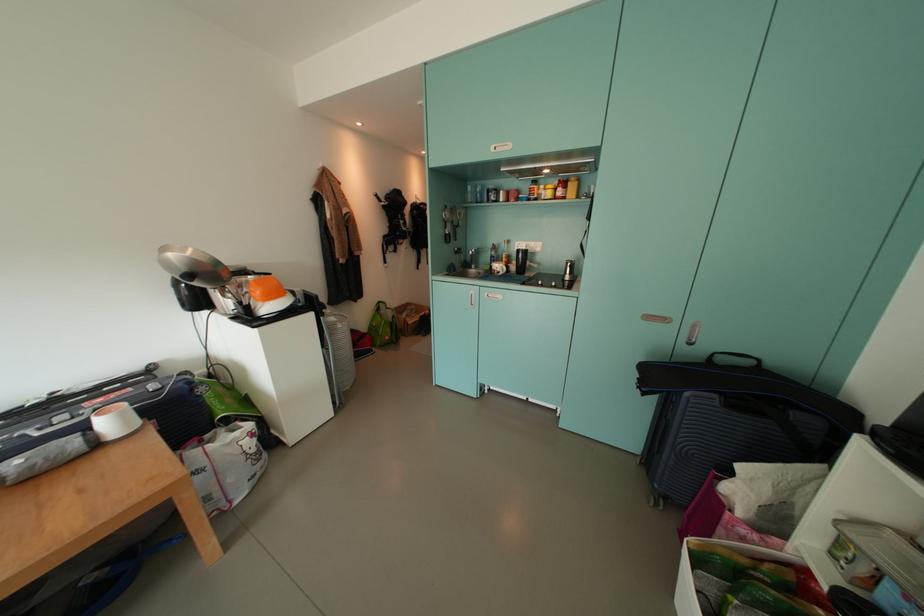
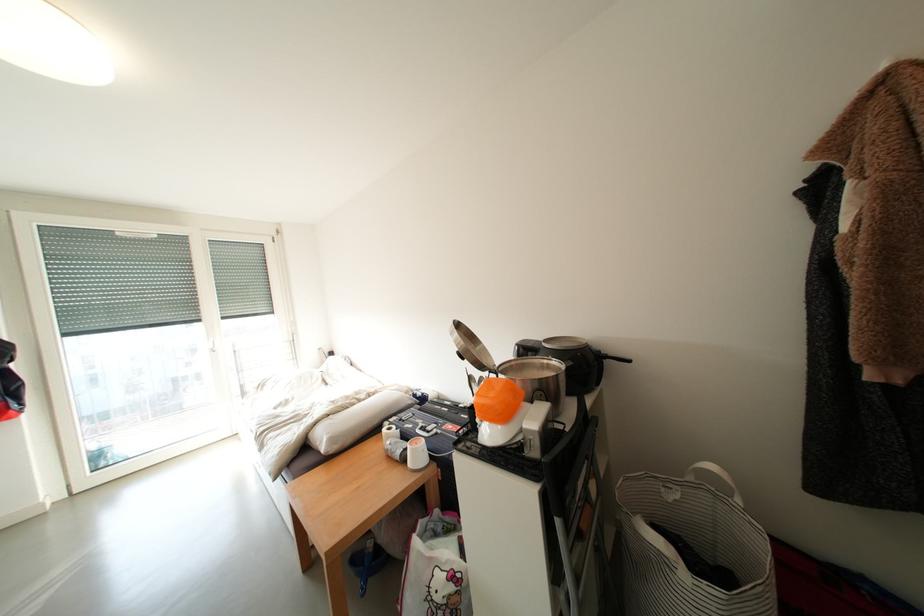
Where in the second image is the point corresponding to [123,426] from the first image?

(424, 456)